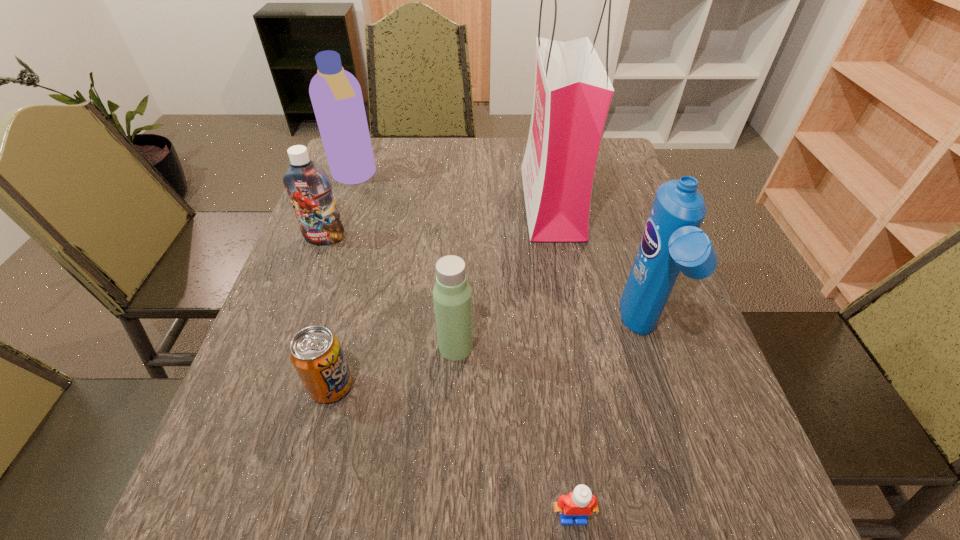
At what (x,y) coordinates should I click in order to perform the action: click on vacant space located on the front-facing side of the shopping bag. Please return your answer as a coordinate pair (x, y). The height and width of the screenshot is (540, 960). Looking at the image, I should click on (482, 202).

Find the location of a particular element. This screenshot has height=540, width=960. vacant area situated 0.370m on the front-facing side of the shopping bag is located at coordinates (392, 202).

Find the location of a particular element. free region located on the front of the farthest shampoo is located at coordinates (324, 264).

Find the location of `vacant space located on the back of the rightmost object`. vacant space located on the back of the rightmost object is located at coordinates (597, 192).

Locate an element on the screen. vacant area situated 0.200m on the front label of the shortest shampoo is located at coordinates (300, 308).

Locate an element on the screen. free space located on the back of the fourth object from right to left is located at coordinates (459, 278).

Where is `vacant space positioned on the back of the soda can`? vacant space positioned on the back of the soda can is located at coordinates (369, 244).

Image resolution: width=960 pixels, height=540 pixels. Identify the location of shopping bag at the far edge. 572,93.

This screenshot has height=540, width=960. Identify the location of shampoo that is at the far edge. (336, 96).

At what (x,y) coordinates should I click in order to perform the action: click on object located in the near edge section of the desktop. Please return your answer as a coordinate pair (x, y). The image size is (960, 540). Looking at the image, I should click on (580, 503).